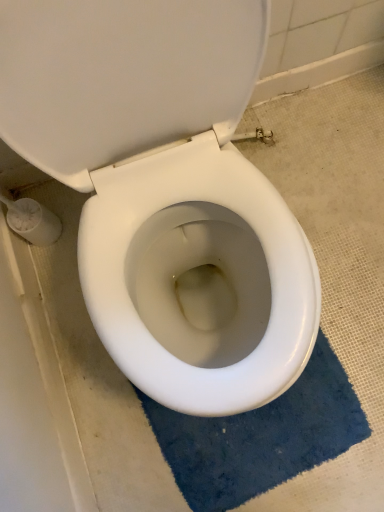
The width and height of the screenshot is (384, 512). Find the location of `white glossy toilet seat at center`. white glossy toilet seat at center is located at coordinates (123, 77).

The height and width of the screenshot is (512, 384). What do you see at coordinates (123, 77) in the screenshot? I see `white glossy toilet seat at center` at bounding box center [123, 77].

This screenshot has width=384, height=512. What do you see at coordinates (261, 437) in the screenshot?
I see `blue plush bath mat at lower center` at bounding box center [261, 437].

You are a GUI agent. You are given a task and a screenshot of the screen. Output one action in this format:
    pyautogui.click(x=<x>, y=<y>)
    Task: Click on the blue plush bath mat at lower center
    
    Given the screenshot: What is the action you would take?
    pyautogui.click(x=261, y=437)

What is the approximate width of blue plush bath mat at lower center?

blue plush bath mat at lower center is 9.08 inches in width.

In order to click on white glossy toilet seat at center in this screenshot , I will do `click(123, 77)`.

Is blue plush bath mat at lower center to the right of white glossy toilet seat at center from the viewer's perspective?

Yes, blue plush bath mat at lower center is to the right of white glossy toilet seat at center.

Which is behind, blue plush bath mat at lower center or white glossy toilet seat at center?

white glossy toilet seat at center is more distant.

Does point (280, 439) appear closer or farther from the camera than point (104, 69)?

Point (280, 439) appears to be farther away from the viewer than point (104, 69).

From the image's perspective, between blue plush bath mat at lower center and white glossy toilet seat at center, who is located below?

blue plush bath mat at lower center, from the image's perspective.

From a real-world perspective, between blue plush bath mat at lower center and white glossy toilet seat at center, who is vertically lower?

blue plush bath mat at lower center, from a real-world perspective.

Which object is thinner, blue plush bath mat at lower center or white glossy toilet seat at center?

white glossy toilet seat at center is thinner.

Who is taller, blue plush bath mat at lower center or white glossy toilet seat at center?

white glossy toilet seat at center is taller.

Between blue plush bath mat at lower center and white glossy toilet seat at center, which one has smaller size?

white glossy toilet seat at center is smaller.

Is blue plush bath mat at lower center not within white glossy toilet seat at center?

blue plush bath mat at lower center lies outside white glossy toilet seat at center's area.

Is blue plush bath mat at lower center in contact with white glossy toilet seat at center?

No, blue plush bath mat at lower center is not with white glossy toilet seat at center.

Looking at this image, does blue plush bath mat at lower center turn towards white glossy toilet seat at center?

No, blue plush bath mat at lower center is not aimed at white glossy toilet seat at center.

Consider the image. Measure the distance between blue plush bath mat at lower center and white glossy toilet seat at center.

blue plush bath mat at lower center and white glossy toilet seat at center are 27.44 inches apart.

The image size is (384, 512). In order to click on bath mat in front of the white glossy toilet seat at center in this screenshot , I will do `click(261, 437)`.

Considering the relative positions of white glossy toilet seat at center and blue plush bath mat at lower center in the image provided, is white glossy toilet seat at center to the left of blue plush bath mat at lower center from the viewer's perspective?

Yes.

Which object is further away from the camera, white glossy toilet seat at center or blue plush bath mat at lower center?

Positioned behind is white glossy toilet seat at center.

Which is nearer, (133, 7) or (337, 425)?

Positioned in front is point (133, 7).

From the image's perspective, which one is positioned higher, white glossy toilet seat at center or blue plush bath mat at lower center?

white glossy toilet seat at center is shown above in the image.

From a real-world perspective, is white glossy toilet seat at center physically located above or below blue plush bath mat at lower center?

From a real-world perspective, white glossy toilet seat at center is physically above blue plush bath mat at lower center.

Between white glossy toilet seat at center and blue plush bath mat at lower center, which one has smaller width?

white glossy toilet seat at center is thinner.

Is white glossy toilet seat at center taller or shorter than blue plush bath mat at lower center?

white glossy toilet seat at center is taller than blue plush bath mat at lower center.

Between white glossy toilet seat at center and blue plush bath mat at lower center, which one has larger size?

blue plush bath mat at lower center.

Is white glossy toilet seat at center inside or outside of blue plush bath mat at lower center?

white glossy toilet seat at center is outside blue plush bath mat at lower center.

Consider the image. Is white glossy toilet seat at center far from blue plush bath mat at lower center?

white glossy toilet seat at center is near blue plush bath mat at lower center, not far away.

Does white glossy toilet seat at center turn towards blue plush bath mat at lower center?

Yes, white glossy toilet seat at center is turned towards blue plush bath mat at lower center.

Find the location of a particular element. The height and width of the screenshot is (512, 384). back that appears on the left of blue plush bath mat at lower center is located at coordinates (123, 77).

Locate an element on the screen. The height and width of the screenshot is (512, 384). back to the left of blue plush bath mat at lower center is located at coordinates (123, 77).

The image size is (384, 512). In order to click on the back above the blue plush bath mat at lower center (from a real-world perspective) in this screenshot , I will do `click(123, 77)`.